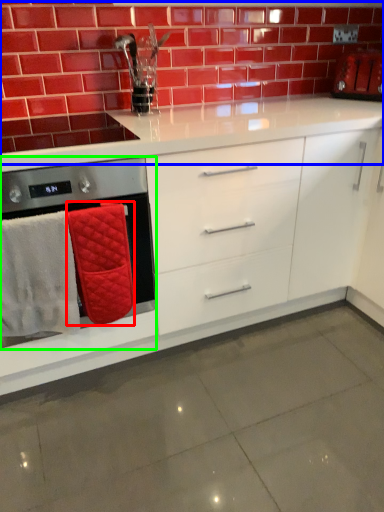
Question: Based on their relative distances, which object is farther from bath towel (highlighted by a red box)? Choose from brickwork (highlighted by a blue box) and home appliance (highlighted by a green box).

Choices:
 (A) brickwork
 (B) home appliance

Answer: (A)